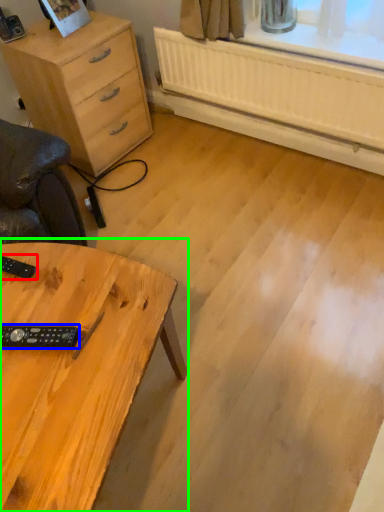
Question: Which object is positioned closest to control (highlighted by a red box)? Select from control (highlighted by a blue box) and table (highlighted by a green box).

Choices:
 (A) control
 (B) table

Answer: (A)